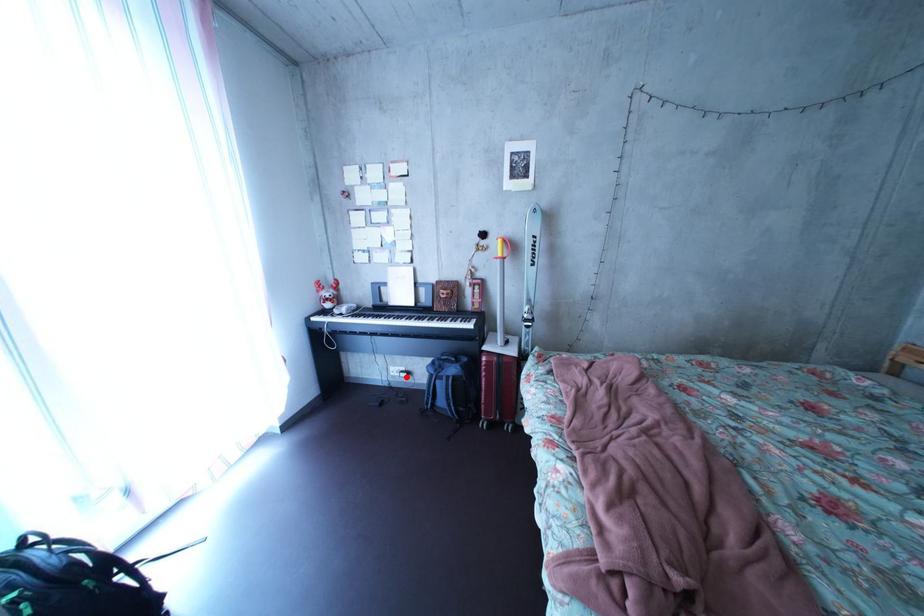
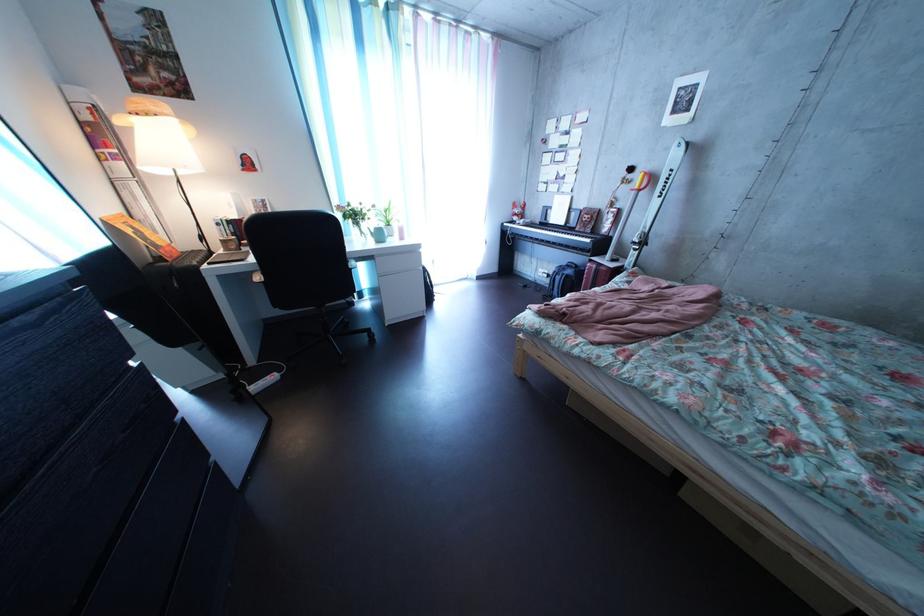
Locate, in the second image, the point that corresponds to the highlighted location in the first image.

(554, 278)